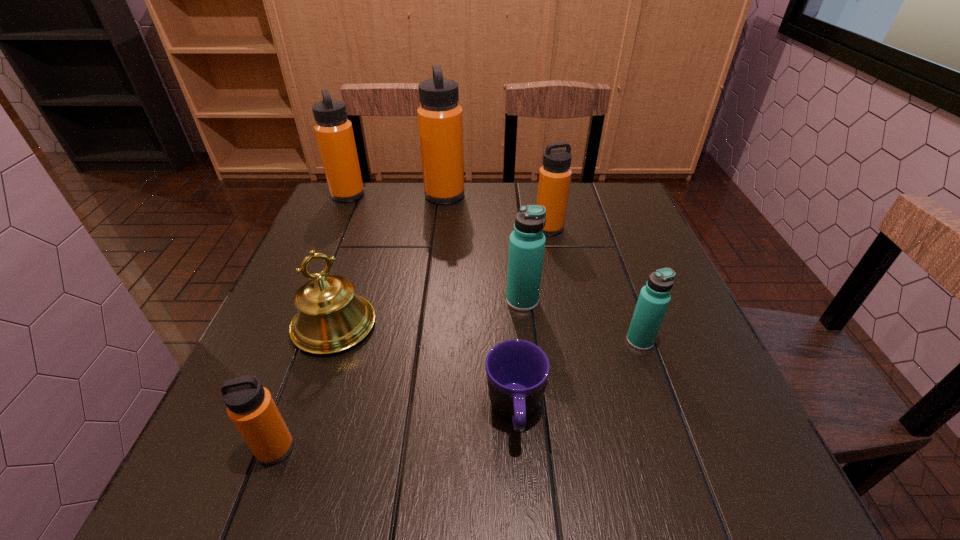
Locate an element on the screen. Image resolution: width=960 pixels, height=540 pixels. free space in the image that satisfies the following two spatial constraints: 1. on the front side of the seventh shortest object; 2. on the left side of the smaller aqua thermos bottle is located at coordinates [x=284, y=341].